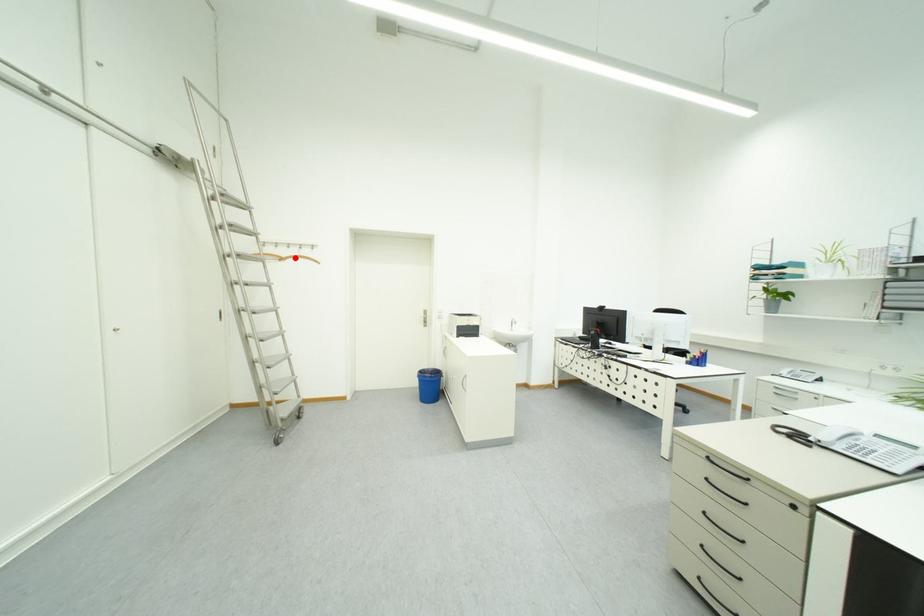
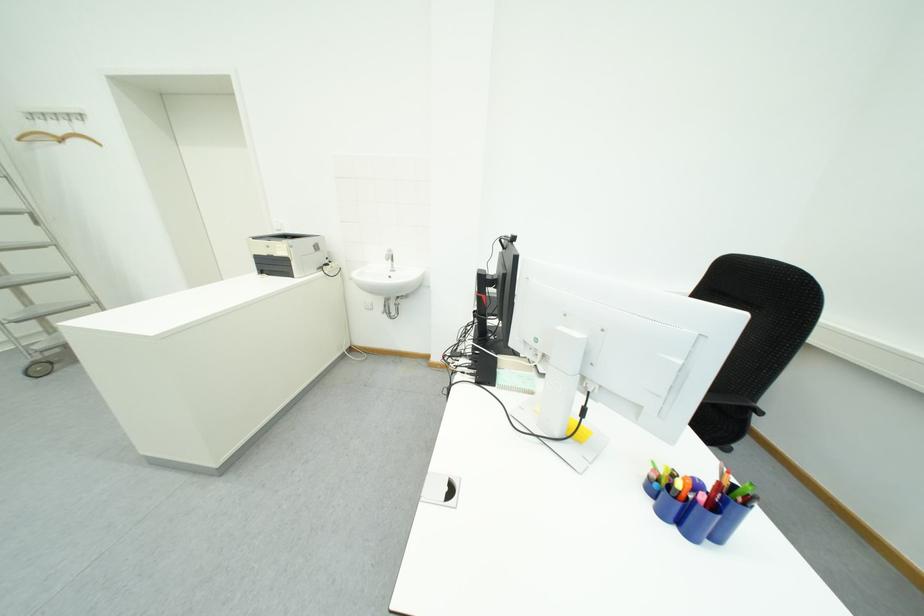
Question: A red point is marked in image1. In image2, is the corresponding 3D point closer to the camera or farther? Reply with the corresponding letter.

Choices:
 (A) The corresponding 3D point is closer.
 (B) The corresponding 3D point is farther.

Answer: (B)